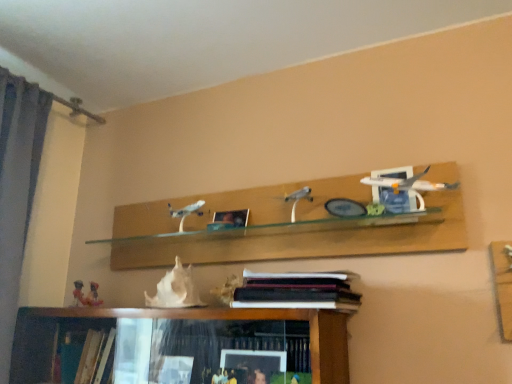
Question: Does white matte seashell at center have a lesser width compared to white glossy airplane at upper right?

Choices:
 (A) no
 (B) yes

Answer: (B)

Question: Is white glossy airplane at upper right inside white matte seashell at center?

Choices:
 (A) no
 (B) yes

Answer: (A)

Question: Is white matte seashell at center oriented towards white glossy airplane at upper right?

Choices:
 (A) no
 (B) yes

Answer: (A)

Question: Is white matte seashell at center with white glossy airplane at upper right?

Choices:
 (A) no
 (B) yes

Answer: (A)

Question: Can we say white matte seashell at center lies outside white glossy airplane at upper right?

Choices:
 (A) no
 (B) yes

Answer: (B)

Question: In the image, is white glossy airplane at upper right on the left side or the right side of metallic silver picture frame at center?

Choices:
 (A) right
 (B) left

Answer: (A)

Question: Looking at their shapes, would you say white glossy airplane at upper right is wider or thinner than metallic silver picture frame at center?

Choices:
 (A) wide
 (B) thin

Answer: (A)

Question: Is point (400, 173) closer or farther from the camera than point (222, 218)?

Choices:
 (A) farther
 (B) closer

Answer: (B)

Question: From the image's perspective, relative to metallic silver picture frame at center, is white glossy airplane at upper right above or below?

Choices:
 (A) below
 (B) above

Answer: (B)

Question: Is white glossy airplane at upper right to the left or to the right of white matte seashell at center in the image?

Choices:
 (A) left
 (B) right

Answer: (B)

Question: From their relative heights in the image, would you say white glossy airplane at upper right is taller or shorter than white matte seashell at center?

Choices:
 (A) short
 (B) tall

Answer: (A)

Question: Considering their positions, is white glossy airplane at upper right located in front of or behind white matte seashell at center?

Choices:
 (A) behind
 (B) front

Answer: (B)

Question: Does point (391, 192) appear closer or farther from the camera than point (197, 299)?

Choices:
 (A) farther
 (B) closer

Answer: (B)

Question: Do you think hardcover books at center is within metallic silver picture frame at center, or outside of it?

Choices:
 (A) inside
 (B) outside

Answer: (B)

Question: In terms of height, does hardcover books at center look taller or shorter compared to metallic silver picture frame at center?

Choices:
 (A) short
 (B) tall

Answer: (A)